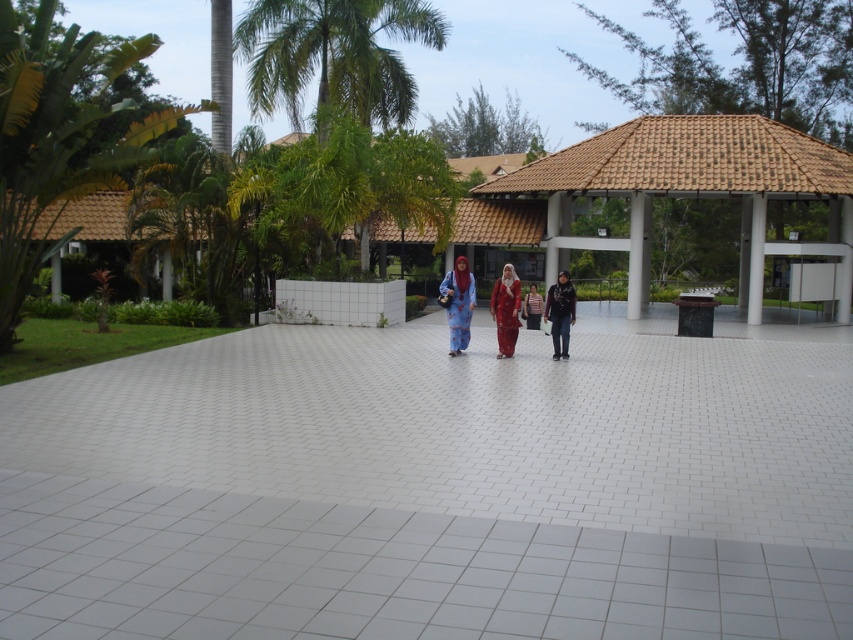
You are a photographer standing at the edge of the paved area. You want to capture a photo that includes both the green leafy palm tree at left and the striped shirt at center. Since you want both subjects in focus, you need to know their heights. Which object is taller?

The green leafy palm tree at left is taller than the striped shirt at center.

You are a photographer planning to take a group photo of the matte blue dress at center and the striped shirt at center. Which of the two should you position closer to the camera to ensure both appear equally sized in the photo?

The striped shirt at center should be positioned closer to the camera because it is smaller in size compared to the matte blue dress at center. By placing it nearer, the two subjects will appear similar in size in the photo.